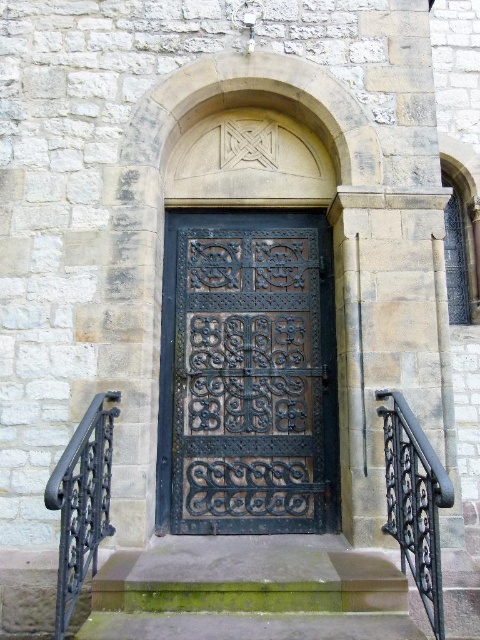
Question: Which point is farther from the camera taking this photo?

Choices:
 (A) (84, 522)
 (B) (278, 477)
 (C) (408, 544)

Answer: (B)

Question: Which point is closer to the camera?

Choices:
 (A) dark brown wrought iron door at center
 (B) black wrought iron railing at left

Answer: (B)

Question: Observing the image, what is the correct spatial positioning of dark brown wrought iron door at center in reference to black wrought iron railing at left?

Choices:
 (A) left
 (B) right

Answer: (B)

Question: Can you confirm if dark brown wrought iron door at center is bigger than black wrought iron railing at right?

Choices:
 (A) yes
 (B) no

Answer: (A)

Question: Is the position of black wrought iron railing at right less distant than that of black wrought iron railing at left?

Choices:
 (A) no
 (B) yes

Answer: (A)

Question: Among these objects, which one is nearest to the camera?

Choices:
 (A) dark brown wrought iron door at center
 (B) black wrought iron railing at right

Answer: (B)